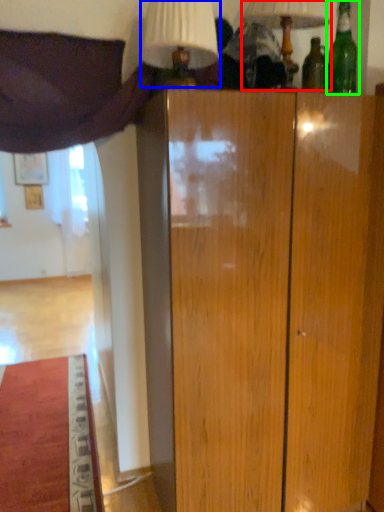
Question: Which is nearer to the table lamp (highlighted by a red box)? table lamp (highlighted by a blue box) or bottle (highlighted by a green box).

Choices:
 (A) table lamp
 (B) bottle

Answer: (B)